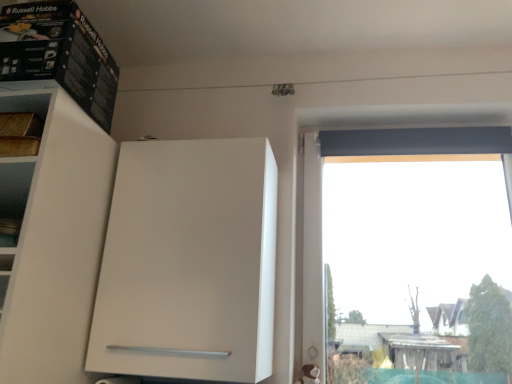
Question: Can you confirm if black cardboard box at upper left is taller than white matte cabinet at center?

Choices:
 (A) no
 (B) yes

Answer: (A)

Question: Does black cardboard box at upper left have a greater width compared to white matte cabinet at center?

Choices:
 (A) yes
 (B) no

Answer: (A)

Question: From the image's perspective, is black cardboard box at upper left beneath white matte cabinet at center?

Choices:
 (A) yes
 (B) no

Answer: (B)

Question: Considering the relative positions of black cardboard box at upper left and white matte cabinet at center in the image provided, is black cardboard box at upper left behind white matte cabinet at center?

Choices:
 (A) yes
 (B) no

Answer: (B)

Question: Considering the relative sizes of black cardboard box at upper left and white matte cabinet at center in the image provided, is black cardboard box at upper left bigger than white matte cabinet at center?

Choices:
 (A) no
 (B) yes

Answer: (A)

Question: Is black cardboard box at upper left positioned beyond the bounds of white matte cabinet at center?

Choices:
 (A) no
 (B) yes

Answer: (B)

Question: Is white matte cabinet at center with black cardboard box at upper left?

Choices:
 (A) no
 (B) yes

Answer: (A)

Question: Is white matte cabinet at center not within black cardboard box at upper left?

Choices:
 (A) no
 (B) yes

Answer: (B)

Question: Considering the relative sizes of white matte cabinet at center and black cardboard box at upper left in the image provided, is white matte cabinet at center smaller than black cardboard box at upper left?

Choices:
 (A) yes
 (B) no

Answer: (B)

Question: Considering the relative sizes of white matte cabinet at center and black cardboard box at upper left in the image provided, is white matte cabinet at center thinner than black cardboard box at upper left?

Choices:
 (A) yes
 (B) no

Answer: (A)

Question: Is white matte cabinet at center not near black cardboard box at upper left?

Choices:
 (A) yes
 (B) no

Answer: (B)

Question: Considering the relative sizes of white matte cabinet at center and black cardboard box at upper left in the image provided, is white matte cabinet at center wider than black cardboard box at upper left?

Choices:
 (A) no
 (B) yes

Answer: (A)

Question: Looking at the image, does black cardboard box at upper left seem bigger or smaller compared to white matte cabinet at center?

Choices:
 (A) big
 (B) small

Answer: (B)